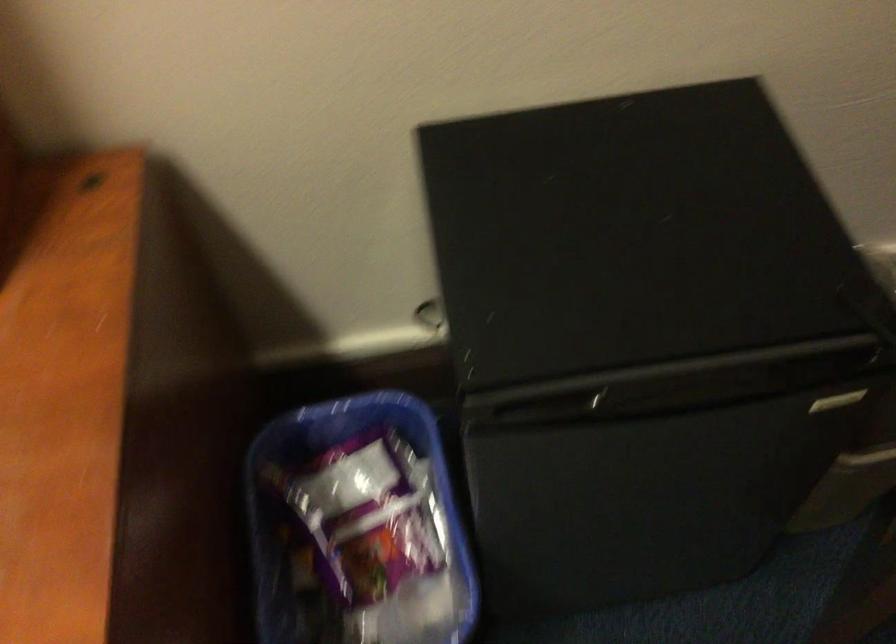
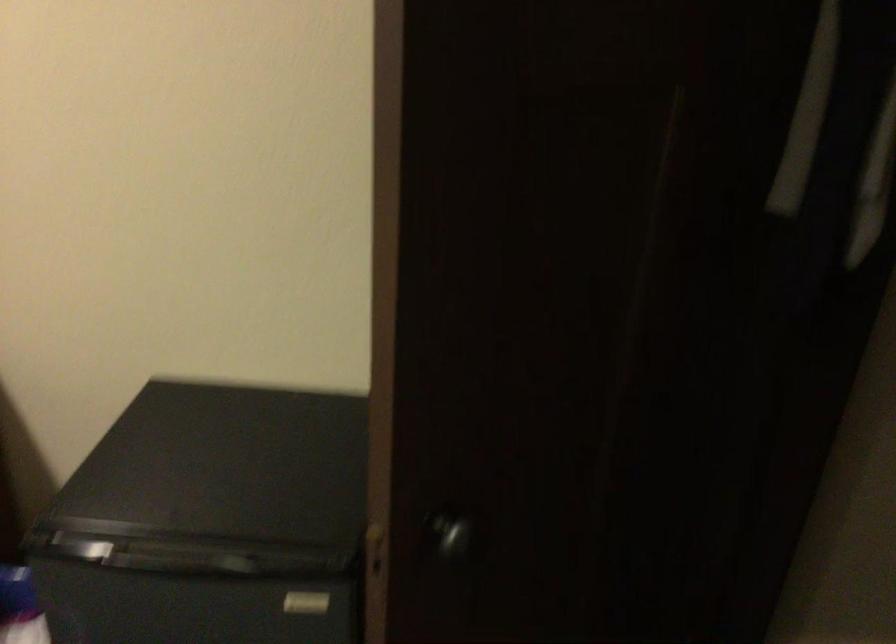
The point at (824, 395) is marked in the first image. Where is the corresponding point in the second image?

(306, 603)